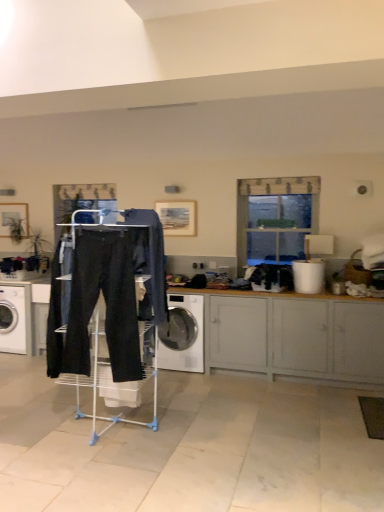
Question: Is clear glass window at upper center in front of or behind white glossy washing machine at left, the 1th washing machine viewed from the left, in the image?

Choices:
 (A) behind
 (B) front

Answer: (B)

Question: Is clear glass window at upper center taller or shorter than white glossy washing machine at left, the 1th washing machine viewed from the left?

Choices:
 (A) short
 (B) tall

Answer: (B)

Question: Estimate the real-world distances between objects in this image. Which object is closer to the white glossy washing machine at left, acting as the 2th washing machine starting from the right?

Choices:
 (A) matte black pants at center
 (B) matte gray cabinet at lower right
 (C) white glossy washing machine at center, the 1th washing machine in the right-to-left sequence
 (D) clear glass window at upper center
 (E) dark blue denim jeans at center

Answer: (C)

Question: Considering the real-world distances, which object is closest to the clear glass window at upper center?

Choices:
 (A) white glossy washing machine at left, acting as the 2th washing machine starting from the right
 (B) matte black pants at center
 (C) black cotton sweat pants at center
 (D) dark blue denim jeans at center
 (E) matte gray cabinet at lower right

Answer: (E)